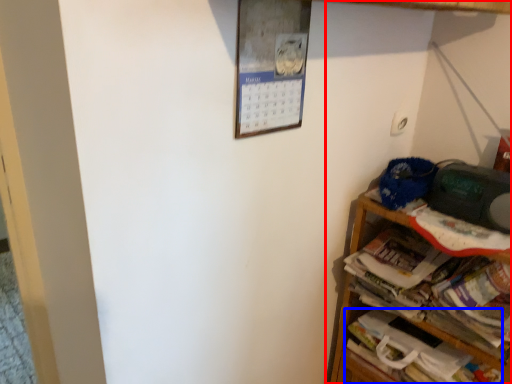
Question: Which object is further to the camera taking this photo, shelf (highlighted by a red box) or book (highlighted by a blue box)?

Choices:
 (A) shelf
 (B) book

Answer: (B)